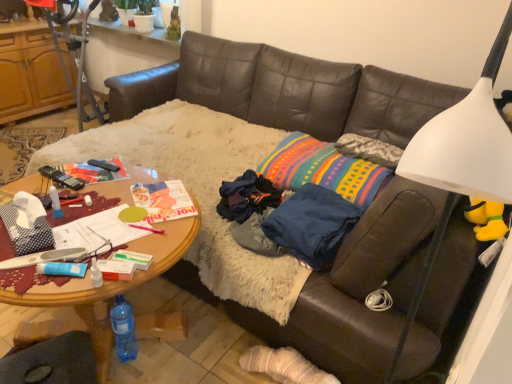
Where is `vacant area in front of black plastic remote control at center`? vacant area in front of black plastic remote control at center is located at coordinates (88, 178).